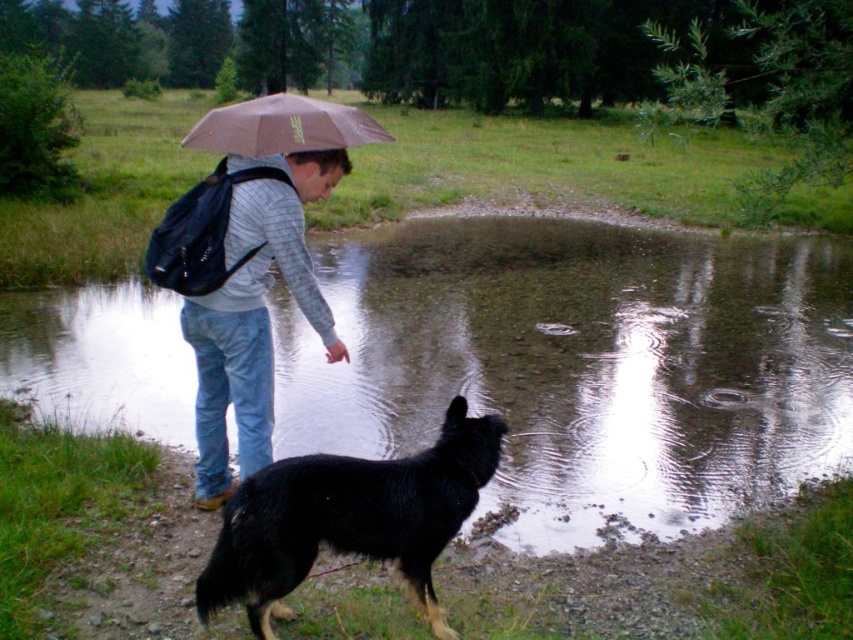
Question: Is glossy reflective water at center below brown matte umbrella at upper center?

Choices:
 (A) yes
 (B) no

Answer: (A)

Question: Can you confirm if glossy reflective water at center is wider than matte gray sweater at center?

Choices:
 (A) no
 (B) yes

Answer: (B)

Question: Which of the following is the farthest from the observer?

Choices:
 (A) brown matte umbrella at upper center
 (B) black shaggy dog at lower center

Answer: (A)

Question: Is glossy reflective water at center smaller than brown matte umbrella at upper center?

Choices:
 (A) yes
 (B) no

Answer: (A)

Question: Considering the real-world distances, which object is farthest from the brown matte umbrella at upper center?

Choices:
 (A) glossy reflective water at center
 (B) matte gray sweater at center

Answer: (A)

Question: Which of these objects is positioned farthest from the brown matte umbrella at upper center?

Choices:
 (A) glossy reflective water at center
 (B) black shaggy dog at lower center
 (C) matte gray sweater at center

Answer: (A)